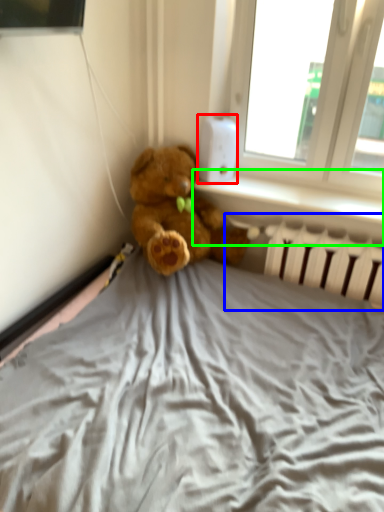
Question: Considering the real-world distances, which object is closest to thermostat (highlighted by a red box)? radiator (highlighted by a blue box) or window sill (highlighted by a green box).

Choices:
 (A) radiator
 (B) window sill

Answer: (B)